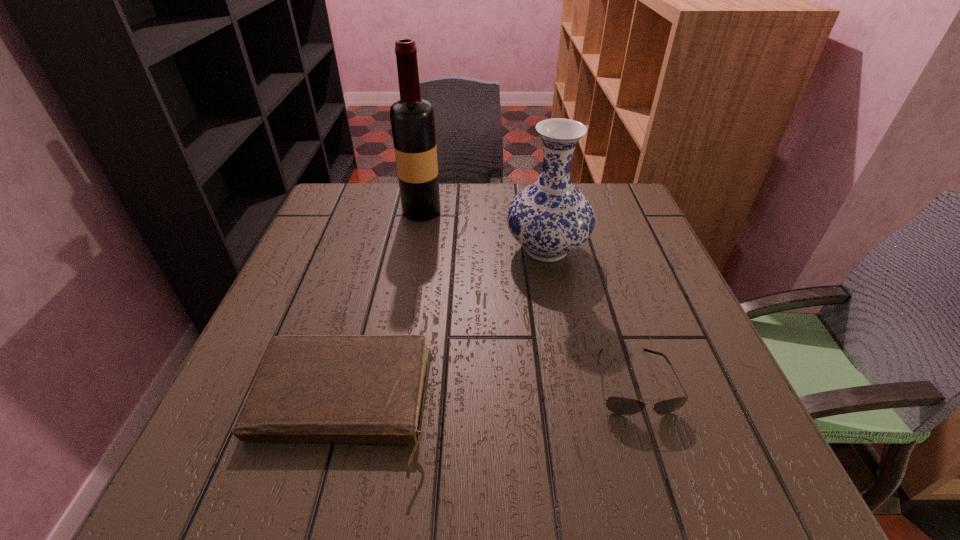
Choose which object is the second nearest neighbor to the sunglasses. Please provide its 2D coordinates. Your answer should be formatted as a tuple, i.e. [(x, y)], where the tuple contains the x and y coordinates of a point satisfying the conditions above.

[(309, 388)]

Image resolution: width=960 pixels, height=540 pixels. I want to click on object that is the second nearest to the sunglasses, so click(309, 388).